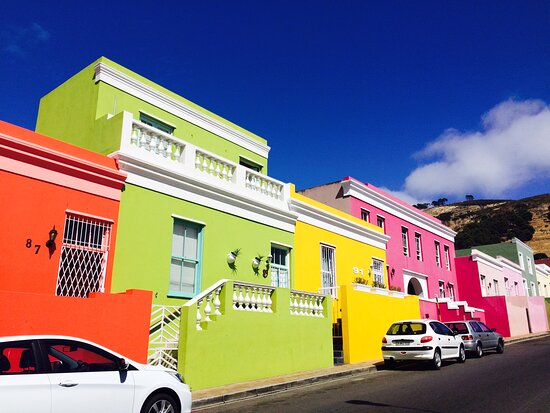
Where is `red wall`? This screenshot has height=413, width=550. red wall is located at coordinates (499, 314).